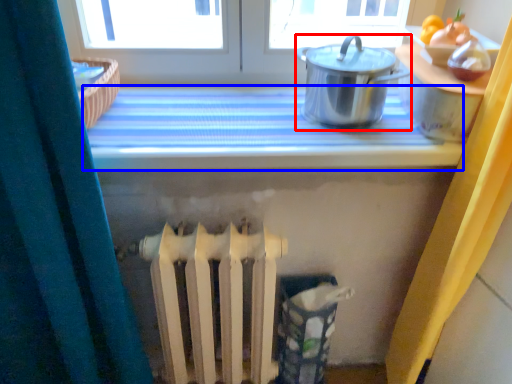
Question: Which object appears farthest to the camera in this image, kitchen appliance (highlighted by a red box) or counter top (highlighted by a blue box)?

Choices:
 (A) kitchen appliance
 (B) counter top

Answer: (B)